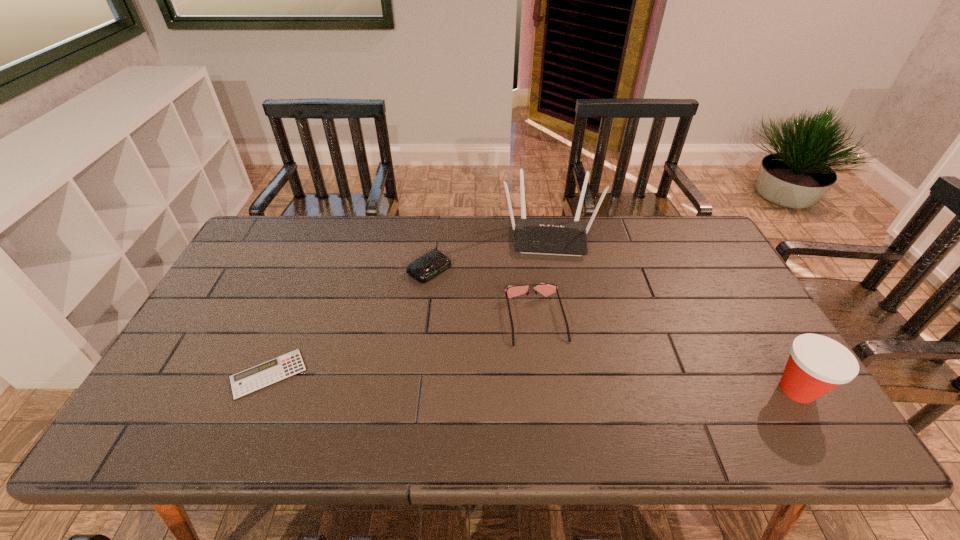
The image size is (960, 540). What are the coordinates of `free area in between the router and the third tallest object` in the screenshot? It's located at (543, 278).

The image size is (960, 540). Find the location of `free space between the shortest object and the Dixie cup`. free space between the shortest object and the Dixie cup is located at coordinates (533, 382).

The height and width of the screenshot is (540, 960). In order to click on free area in between the sunglasses and the router in this screenshot , I will do `click(543, 278)`.

Select which object appears as the fourth closest to the tallest object. Please provide its 2D coordinates. Your answer should be formatted as a tuple, i.e. [(x, y)], where the tuple contains the x and y coordinates of a point satisfying the conditions above.

[(252, 379)]

This screenshot has height=540, width=960. In order to click on object that stands as the closest to the Dixie cup in this screenshot , I will do `click(545, 289)`.

Locate an element on the screen. vacant region that satisfies the following two spatial constraints: 1. on the front side of the sunglasses; 2. on the left side of the Dixie cup is located at coordinates (544, 389).

Locate an element on the screen. The width and height of the screenshot is (960, 540). free space that satisfies the following two spatial constraints: 1. on the front side of the alarm clock; 2. on the left side of the Dixie cup is located at coordinates (415, 389).